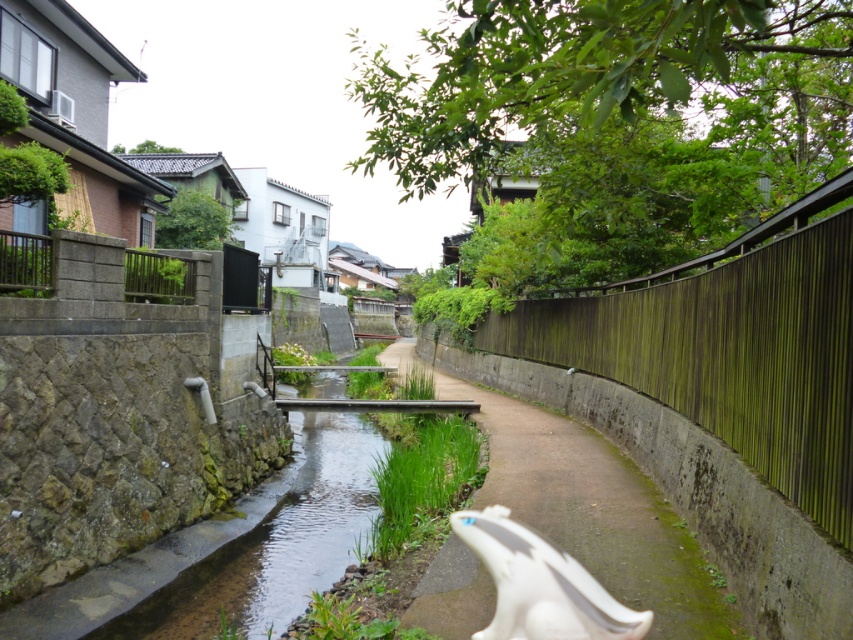
Question: Can you confirm if brown concrete path at center is positioned to the left of clear water at center?

Choices:
 (A) no
 (B) yes

Answer: (A)

Question: Does green mossy wood fence at right appear over brown concrete path at center?

Choices:
 (A) no
 (B) yes

Answer: (B)

Question: Considering the real-world distances, which object is farthest from the clear water at center?

Choices:
 (A) brown concrete path at center
 (B) green mossy wood fence at right
 (C) white glossy statue at center

Answer: (B)

Question: Which of the following is the closest to the observer?

Choices:
 (A) (364, 499)
 (B) (521, 616)
 (C) (610, 552)
 (D) (778, 410)

Answer: (B)

Question: Which object is farther from the camera taking this photo?

Choices:
 (A) white glossy statue at center
 (B) clear water at center
 (C) green mossy wood fence at right

Answer: (B)

Question: Is the position of brown concrete path at center more distant than that of white glossy statue at center?

Choices:
 (A) yes
 (B) no

Answer: (A)